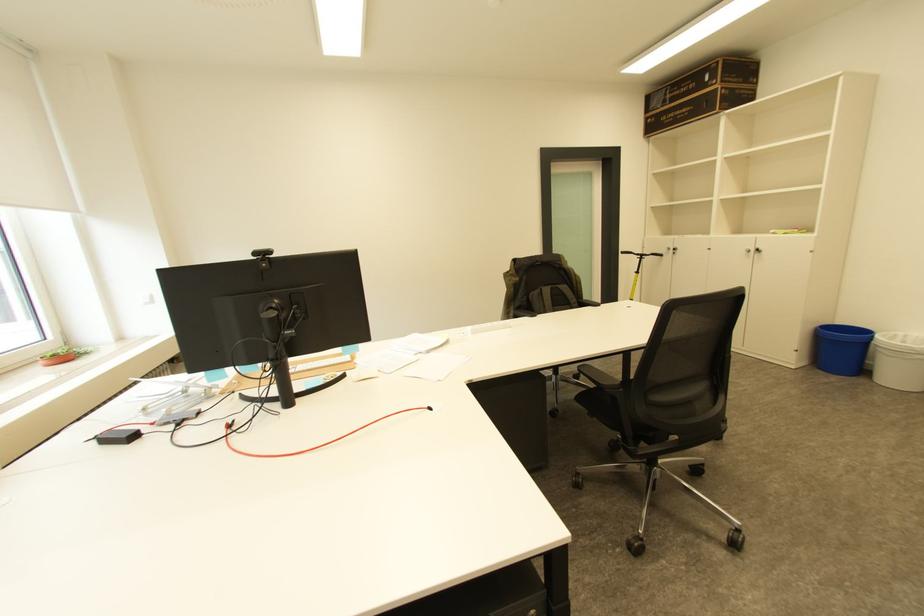
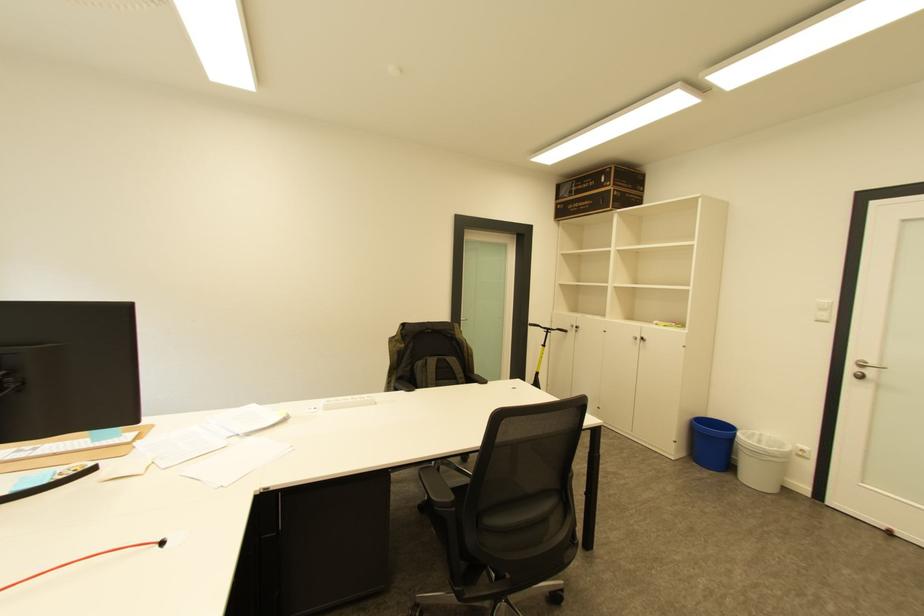
Question: Based on the continuous images, in which direction is the camera rotating? Reply with the corresponding letter.

Choices:
 (A) Left
 (B) Right
 (C) Up
 (D) Down

Answer: (B)